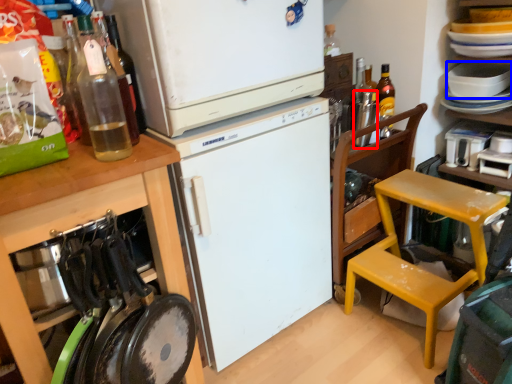
Question: Which point is further to the camera, bottle (highlighted by a red box) or appliance (highlighted by a blue box)?

Choices:
 (A) bottle
 (B) appliance

Answer: (B)